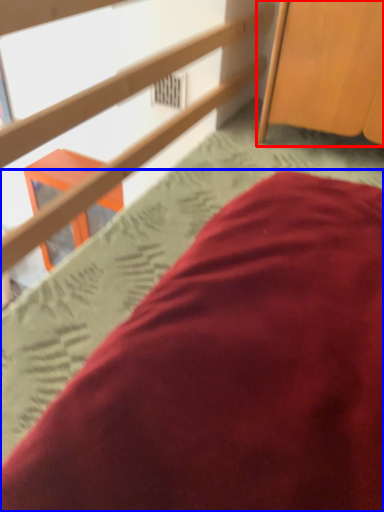
Question: Which of the following is the farthest to the observer, furniture (highlighted by a red box) or bed (highlighted by a blue box)?

Choices:
 (A) furniture
 (B) bed

Answer: (A)